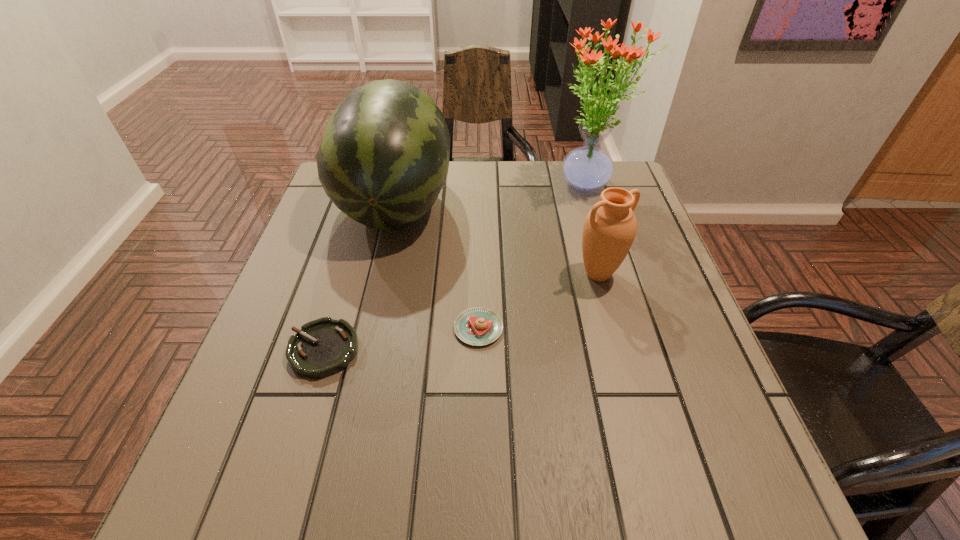
You are a GUI agent. You are given a task and a screenshot of the screen. Output one action in this format:
    pyautogui.click(x=<x>, y=<y>)
    Task: Click on the blank space located 0.330m on the right of the ashtray
    
    Given the screenshot: What is the action you would take?
    pyautogui.click(x=530, y=349)

Locate an element on the screen. This screenshot has height=540, width=960. flower arrangement located in the far edge section of the desktop is located at coordinates (586, 168).

The width and height of the screenshot is (960, 540). Identify the location of watermelon that is at the far edge. (384, 157).

Identify the location of watermelon that is at the left edge. The image size is (960, 540). (384, 157).

Locate an element on the screen. ashtray present at the left edge is located at coordinates (323, 347).

At what (x,y) coordinates should I click in order to perform the action: click on flower arrangement that is at the right edge. Please return your answer as a coordinate pair (x, y). Looking at the image, I should click on (586, 168).

The image size is (960, 540). I want to click on urn present at the right edge, so click(610, 227).

Where is `object that is at the far left corner`? The height and width of the screenshot is (540, 960). object that is at the far left corner is located at coordinates (x=384, y=157).

Locate an element on the screen. Image resolution: width=960 pixels, height=540 pixels. object present at the far right corner is located at coordinates (586, 168).

In order to click on vacant point at the far edge in this screenshot , I will do `click(497, 172)`.